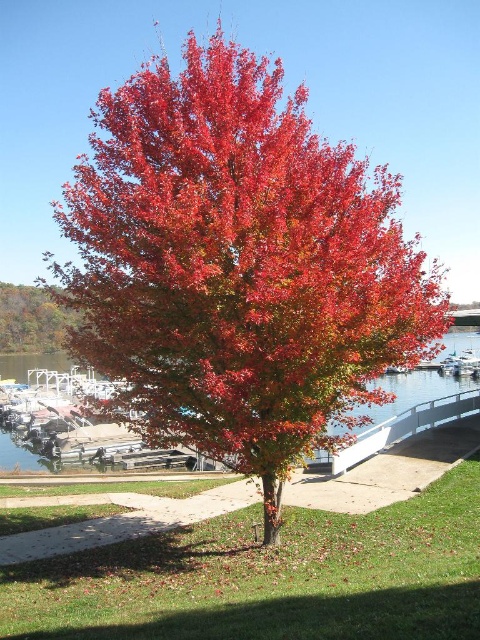
Question: Does shiny red maple tree at center appear on the left side of clear water at center?

Choices:
 (A) yes
 (B) no

Answer: (B)

Question: Does clear water at center appear on the left side of shiny brown tree at left?

Choices:
 (A) yes
 (B) no

Answer: (B)

Question: Considering the relative positions of clear water at center and shiny brown tree at left in the image provided, where is clear water at center located with respect to shiny brown tree at left?

Choices:
 (A) left
 (B) right

Answer: (B)

Question: Which point appears farthest from the camera in this image?

Choices:
 (A) (222, 138)
 (B) (39, 365)
 (C) (12, 321)

Answer: (B)

Question: Which object appears farthest from the camera in this image?

Choices:
 (A) shiny red maple tree at center
 (B) shiny brown tree at left
 (C) clear water at center

Answer: (B)

Question: Which object is the closest to the shiny brown tree at left?

Choices:
 (A) shiny red maple tree at center
 (B) clear water at center

Answer: (B)